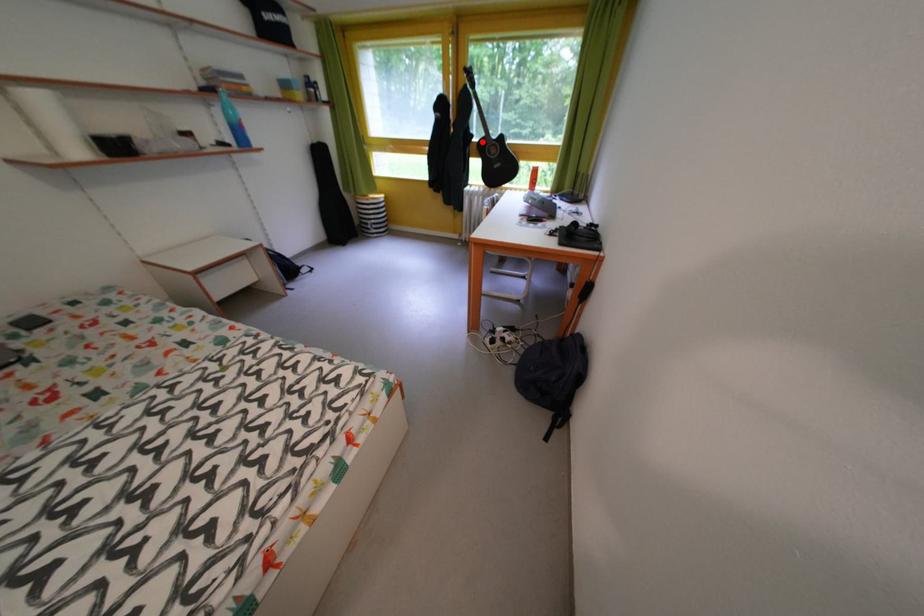
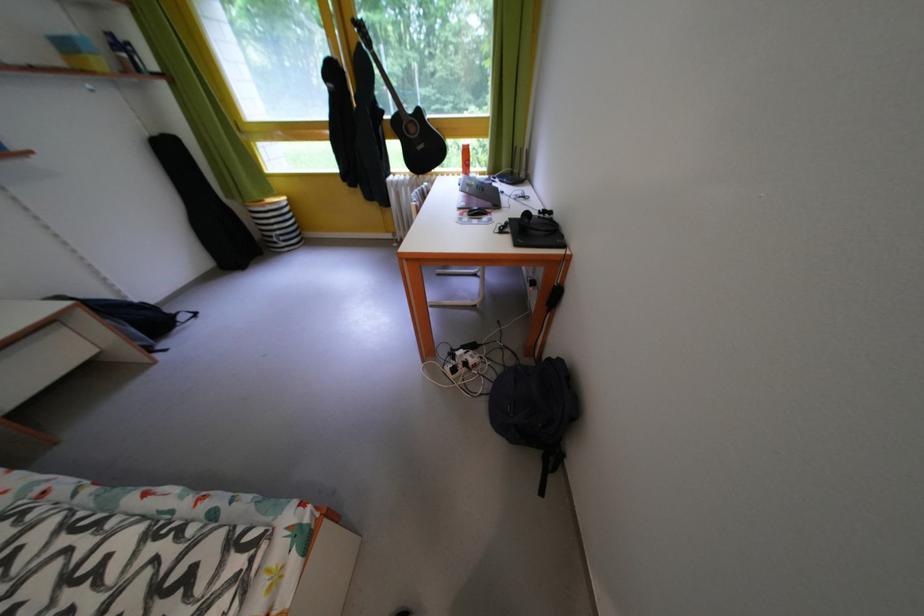
In the second image, find the point that corresponds to the highlighted location in the first image.

(393, 118)